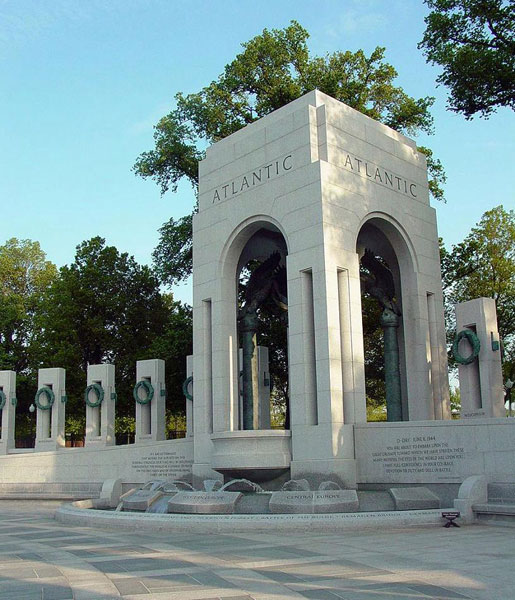
Locate an element on the screen. The image size is (515, 600). wall is located at coordinates (487, 447), (185, 448).